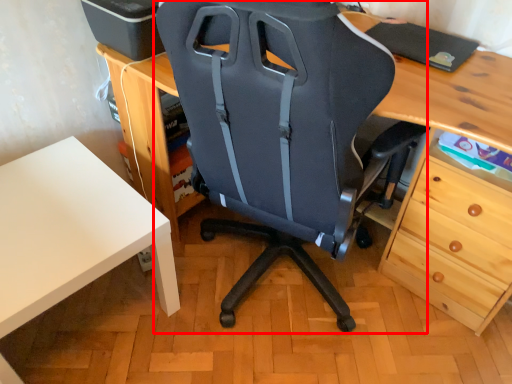
Question: From the image, what is the correct spatial relationship of chair (annotated by the red box) in relation to table?

Choices:
 (A) left
 (B) right

Answer: (B)